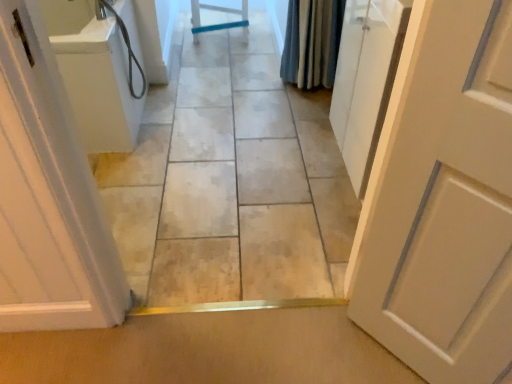
Identify the location of free point below blue textured fabric shower curtain at upper right (from a real-world perspective). (291, 93).